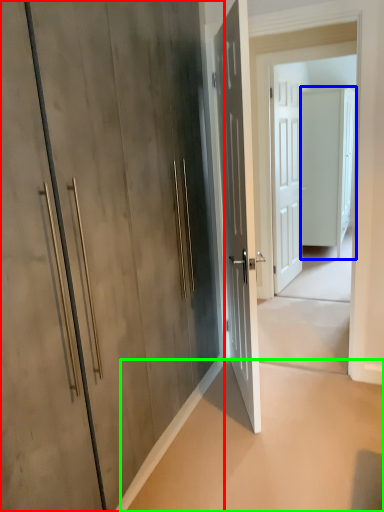
Question: Estimate the real-world distances between objects in this image. Which object is closer to door (highlighted by a red box), door (highlighted by a blue box) or concrete (highlighted by a green box)?

Choices:
 (A) door
 (B) concrete

Answer: (B)